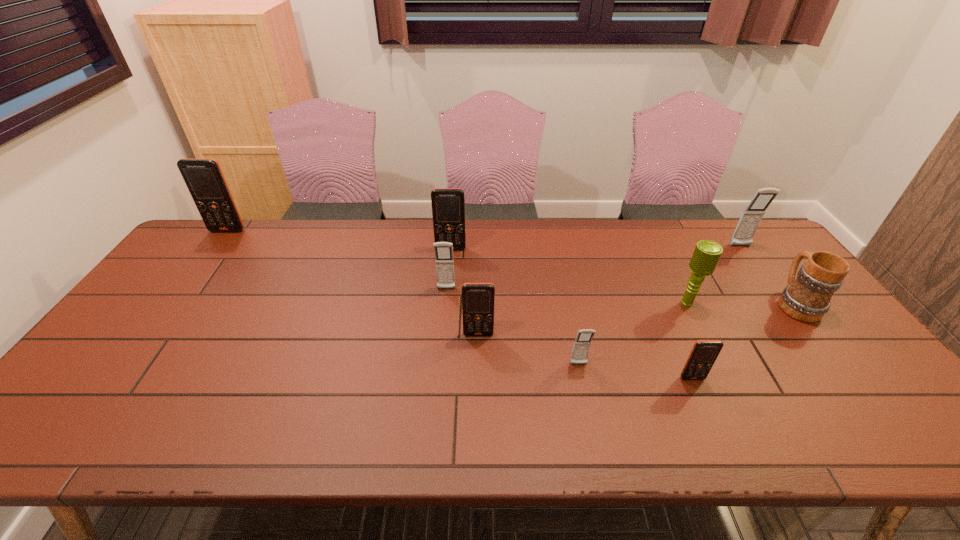
Locate an element on the screen. Image resolution: width=960 pixels, height=540 pixels. vacant space located on the front-facing side of the fourth nearest cellular telephone is located at coordinates (440, 366).

I want to click on free region located on the screen of the fourth cellular telephone from right to left, so click(x=478, y=388).

At what (x,y) coordinates should I click in order to perform the action: click on free spot located on the side of the mug with the handle. Please return your answer as a coordinate pair (x, y). The height and width of the screenshot is (540, 960). Looking at the image, I should click on (765, 264).

This screenshot has height=540, width=960. What are the coordinates of `free space located 0.250m on the side of the mug with the handle` in the screenshot? It's located at (743, 236).

Where is `free region located on the side of the mug with the handle`? free region located on the side of the mug with the handle is located at coordinates pos(752,246).

Where is `vacant space located on the screen of the fourth object from right to left`? The height and width of the screenshot is (540, 960). vacant space located on the screen of the fourth object from right to left is located at coordinates (721, 443).

Where is `blank area located on the front-facing side of the second gray cellular telephone from left to right`? blank area located on the front-facing side of the second gray cellular telephone from left to right is located at coordinates (588, 406).

You are a GUI agent. You are given a task and a screenshot of the screen. Output one action in this format:
    pyautogui.click(x=<x>, y=<y>)
    Task: Click on the object located in the left edge section of the desktop
    This screenshot has width=960, height=540.
    Given the screenshot: What is the action you would take?
    pyautogui.click(x=204, y=179)

The image size is (960, 540). What are the coordinates of `cellular telephone that is at the right edge` in the screenshot? It's located at (743, 235).

This screenshot has width=960, height=540. In order to click on mug located at the right edge in this screenshot , I will do `click(807, 298)`.